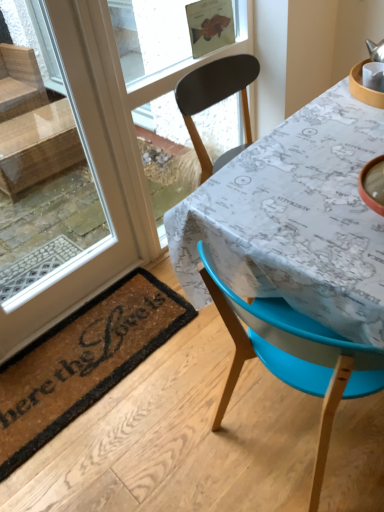
Locate an element on the screen. The width and height of the screenshot is (384, 512). vacant space in front of brown coir mat at lower left is located at coordinates (119, 456).